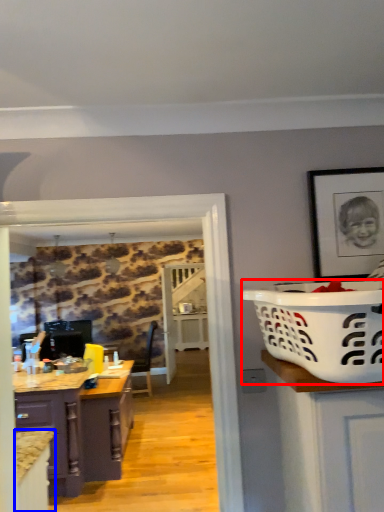
Question: Which of the following is the closest to the observer, basket container (highlighted by a red box) or cabinetry (highlighted by a blue box)?

Choices:
 (A) basket container
 (B) cabinetry

Answer: (A)